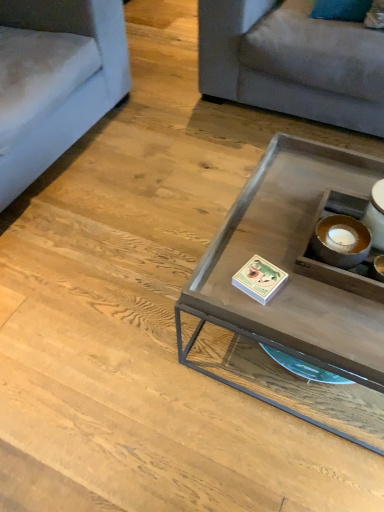
Question: Based on their positions, is matte glass coffee table at center located to the left or right of light gray fabric couch at upper right, the 1th studio couch from the right?

Choices:
 (A) left
 (B) right

Answer: (A)

Question: From a real-world perspective, relative to light gray fabric couch at upper right, which is counted as the second studio couch, starting from the left, is matte glass coffee table at center vertically above or below?

Choices:
 (A) above
 (B) below

Answer: (B)

Question: Which is farther from the light gray fabric couch at upper right, which is counted as the second studio couch, starting from the left?

Choices:
 (A) light blue fabric couch at left, which is the second studio couch in right-to-left order
 (B) matte glass coffee table at center

Answer: (B)

Question: Considering the real-world distances, which object is closest to the light blue fabric couch at left, which is the second studio couch in right-to-left order?

Choices:
 (A) matte glass coffee table at center
 (B) light gray fabric couch at upper right, the 1th studio couch from the right

Answer: (B)